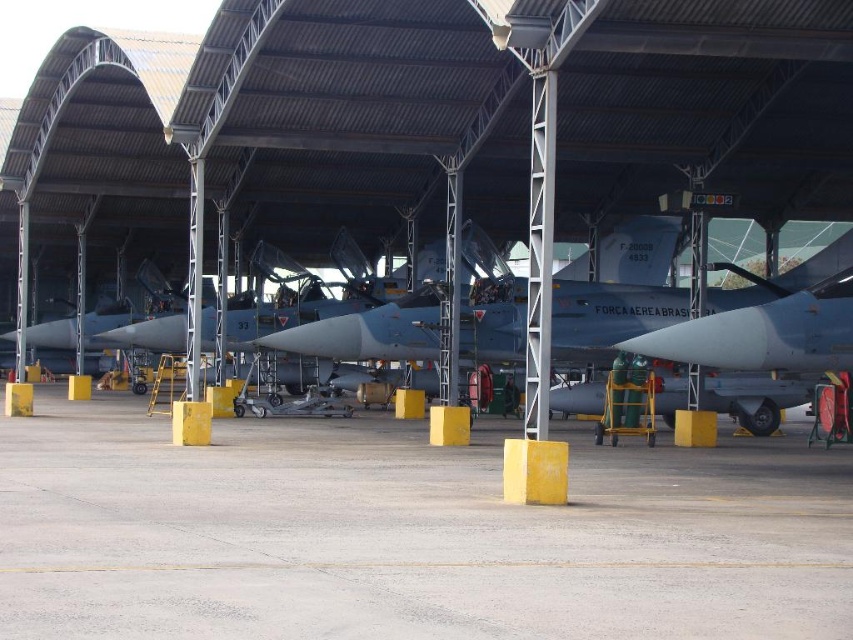
Is point (91, 632) less distant than point (287, 352)?

Yes, point (91, 632) is closer to viewer.

Is gray concrete tarmac at center positioned behind matte gray jet at center?

No, it is not.

Image resolution: width=853 pixels, height=640 pixels. In order to click on gray concrete tarmac at center in this screenshot , I will do `click(405, 534)`.